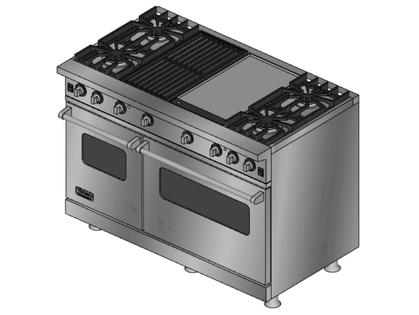
Where is `glass window on left`? This screenshot has height=315, width=419. glass window on left is located at coordinates (107, 155).